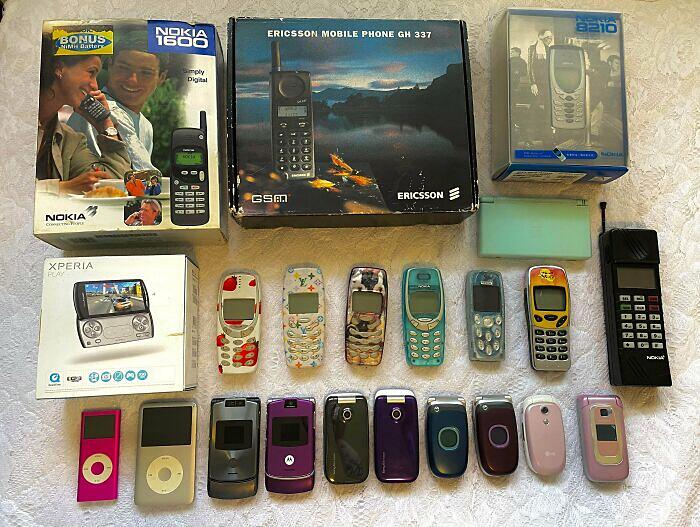
The image size is (700, 527). What are the coordinates of `box` in the screenshot? It's located at (346, 86), (530, 75), (97, 111), (168, 331).